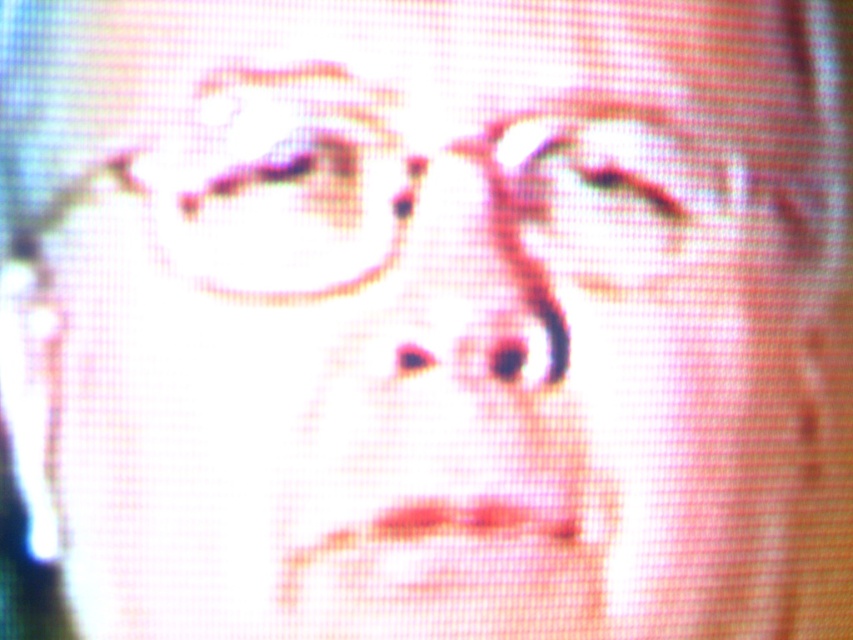
Question: Observing the image, what is the correct spatial positioning of matte plastic glasses at center in reference to matte pink eyebrow at upper center?

Choices:
 (A) above
 (B) below

Answer: (B)

Question: Does matte plastic glasses at center have a larger size compared to matte pink eyebrow at upper center?

Choices:
 (A) no
 (B) yes

Answer: (B)

Question: Is matte plastic glasses at center below matte pink eyebrow at upper center?

Choices:
 (A) yes
 (B) no

Answer: (A)